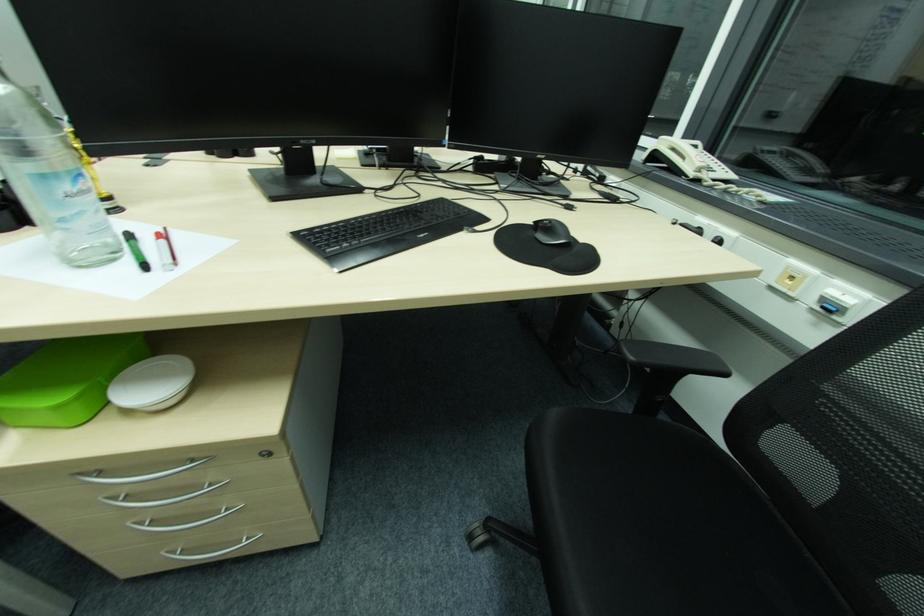
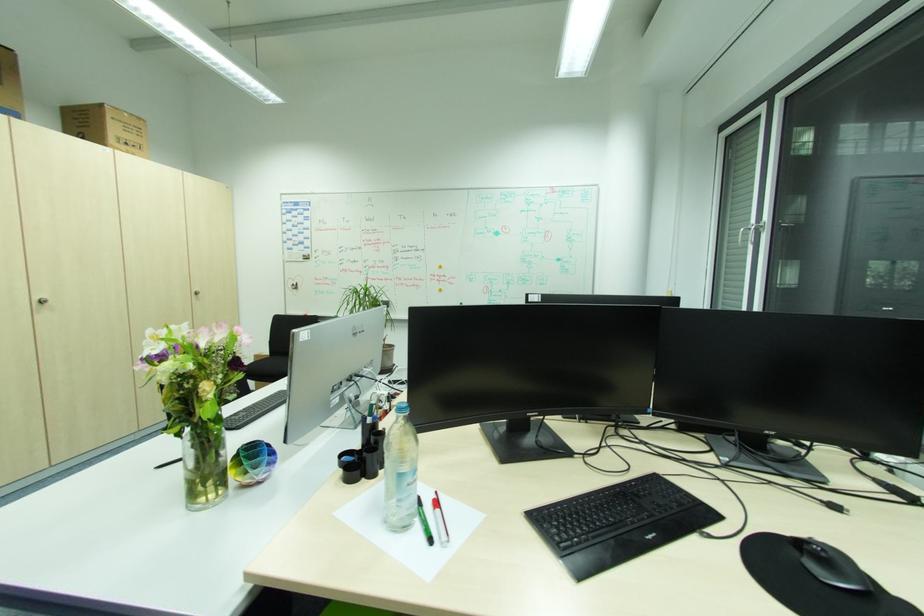
Find the pixel in the second image that matches (x=86, y=211) in the first image.

(417, 495)